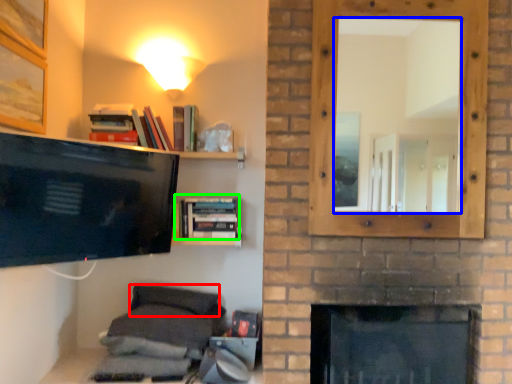
Question: Which is nearer to the pillow (highlighted by a red box)? mirror (highlighted by a blue box) or book (highlighted by a green box).

Choices:
 (A) mirror
 (B) book

Answer: (B)